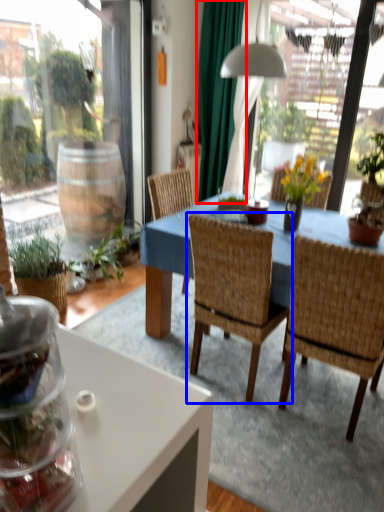
Question: Which object appears farthest to the camera in this image, curtain (highlighted by a red box) or chair (highlighted by a blue box)?

Choices:
 (A) curtain
 (B) chair

Answer: (A)